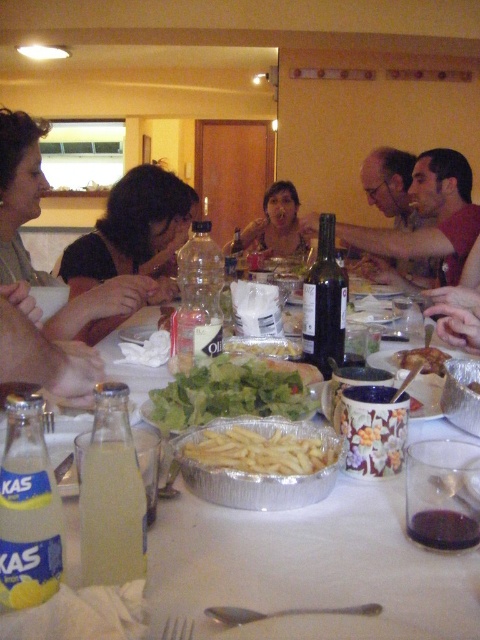
Does clear plastic bottle at center appear on the right side of dark glass bottle at center?

No, clear plastic bottle at center is not to the right of dark glass bottle at center.

The height and width of the screenshot is (640, 480). What are the coordinates of `clear plastic bottle at center` in the screenshot? It's located at (196, 300).

Which is behind, point (217, 328) or point (335, 320)?

Positioned behind is point (335, 320).

Where is `clear plastic bottle at center`? Image resolution: width=480 pixels, height=640 pixels. clear plastic bottle at center is located at coordinates (196, 300).

Between yellow glass bottle at lower left and dark glass bottle at center, which one appears on the right side from the viewer's perspective?

dark glass bottle at center is more to the right.

Can you confirm if yellow glass bottle at lower left is bigger than dark glass bottle at center?

No, yellow glass bottle at lower left is not bigger than dark glass bottle at center.

The height and width of the screenshot is (640, 480). What do you see at coordinates (27, 509) in the screenshot? I see `yellow glass bottle at lower left` at bounding box center [27, 509].

Find the location of a particular element. yellow glass bottle at lower left is located at coordinates (27, 509).

Is dark glass bottle at center further to the viewer compared to translucent plastic bottle at center?

No, dark glass bottle at center is in front of translucent plastic bottle at center.

Between dark glass bottle at center and translucent plastic bottle at center, which one appears on the left side from the viewer's perspective?

Positioned to the left is translucent plastic bottle at center.

Is point (326, 285) more distant than point (235, 243)?

That is False.

The width and height of the screenshot is (480, 640). What are the coordinates of `dark glass bottle at center` in the screenshot? It's located at (324, 301).